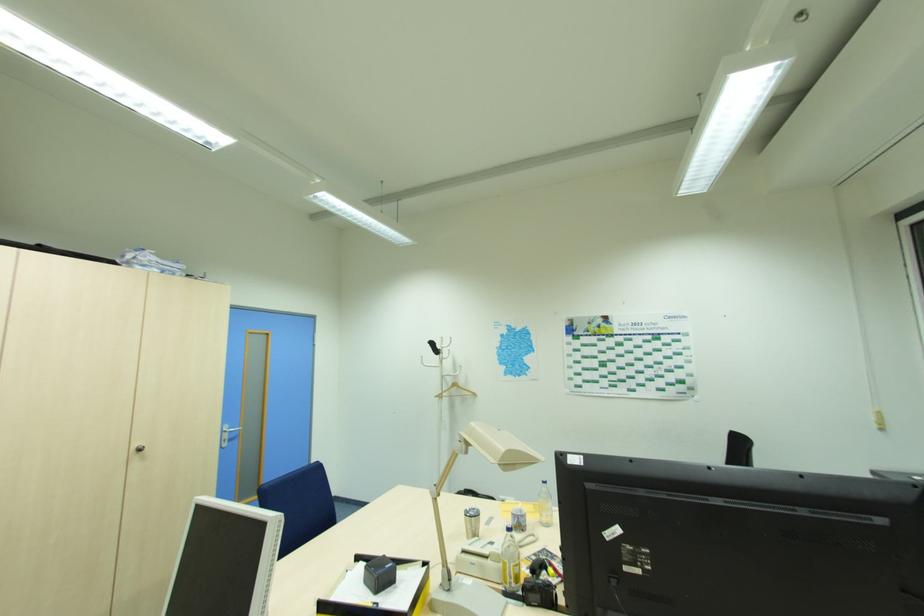
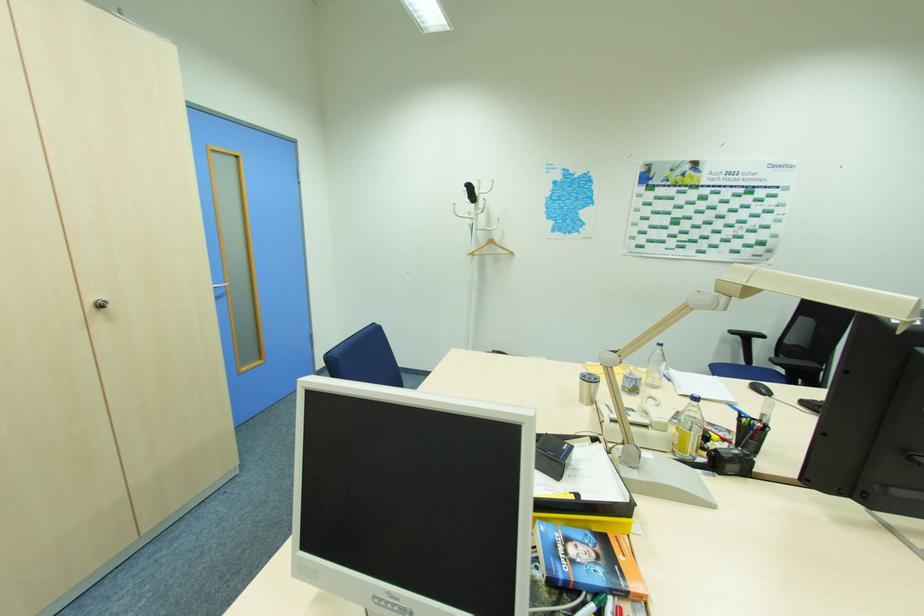
Find the pixel in the second image that matches point (439, 397) in the first image.

(472, 254)